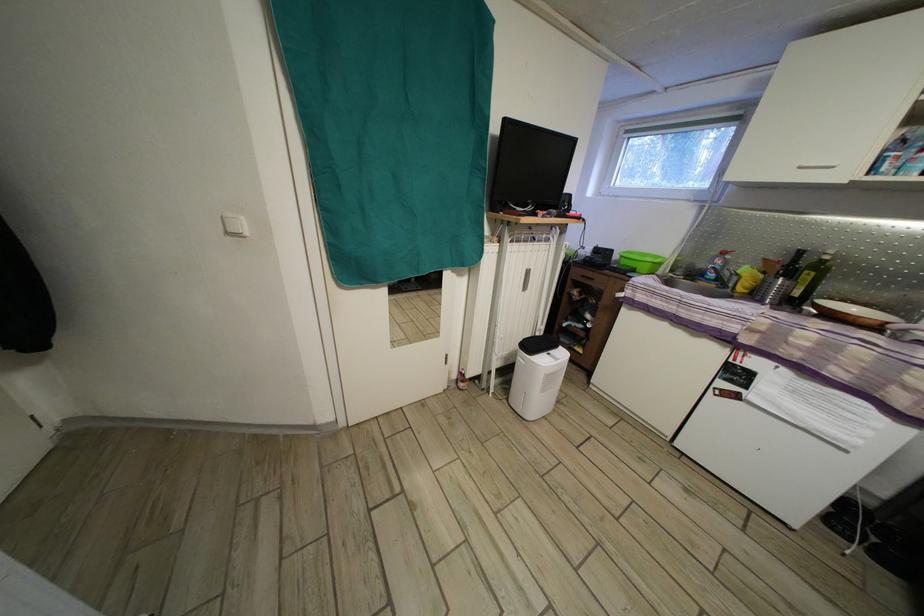
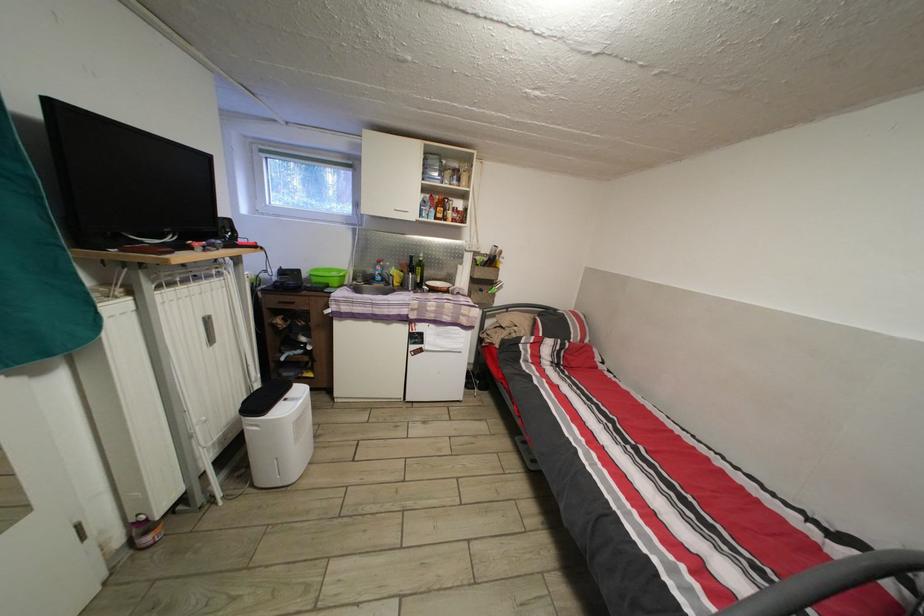
Find the pixel in the second image that matches the point at 733,270 in the first image.

(390, 274)